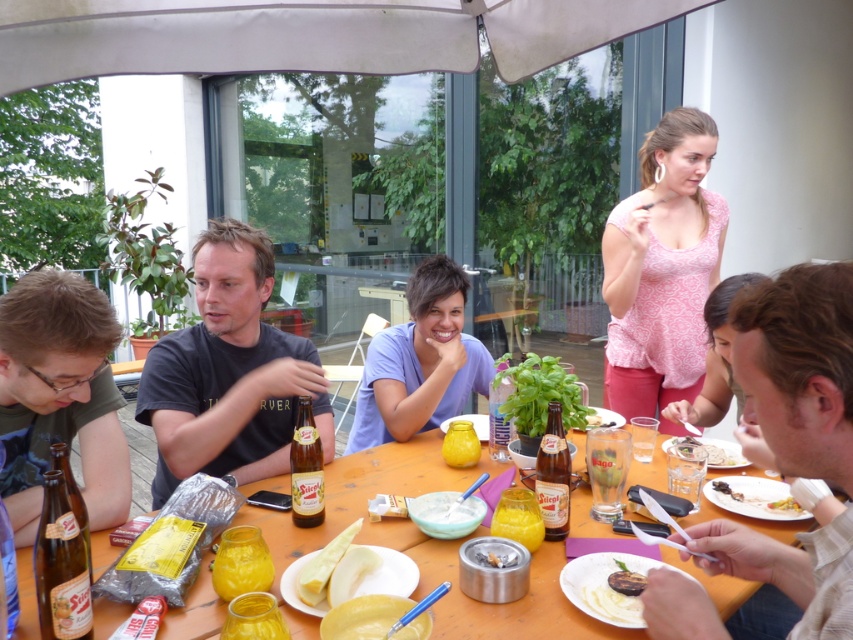
Can you confirm if smooth white plate at lower center is wider than yellow matte plate at lower right?

Indeed, smooth white plate at lower center has a greater width compared to yellow matte plate at lower right.

Between smooth white plate at lower center and yellow matte plate at lower right, which one is positioned lower?

smooth white plate at lower center is lower down.

Find the location of `smooth white plate at lower center`. smooth white plate at lower center is located at coordinates (618, 595).

Between light brown wooden table at center and dark gray t-shirt at center, which one appears on the right side from the viewer's perspective?

Positioned to the right is light brown wooden table at center.

Which is below, light brown wooden table at center or dark gray t-shirt at center?

Positioned lower is light brown wooden table at center.

Does point (796, 416) lie behind point (215, 374)?

That is False.

In order to click on light brown wooden table at center in this screenshot , I will do `click(798, 371)`.

Which is in front, point (433, 477) or point (316, 513)?

Point (316, 513) is in front.

Does wooden table at center have a lesser height compared to translucent glass bottle at center?

Indeed, wooden table at center has a lesser height compared to translucent glass bottle at center.

This screenshot has width=853, height=640. Find the location of `wooden table at center`. wooden table at center is located at coordinates (361, 492).